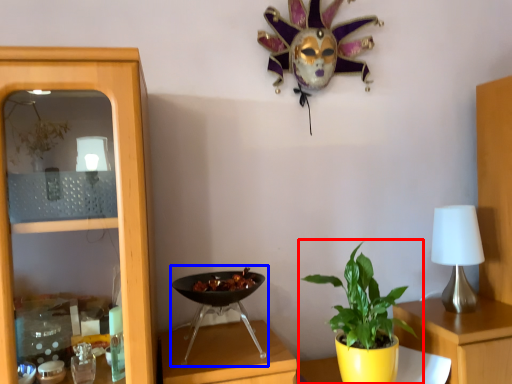
Question: Among these objects, which one is farthest to the camera, houseplant (highlighted by a red box) or wok (highlighted by a blue box)?

Choices:
 (A) houseplant
 (B) wok

Answer: (A)